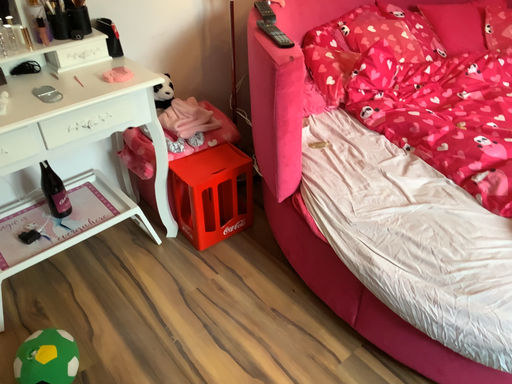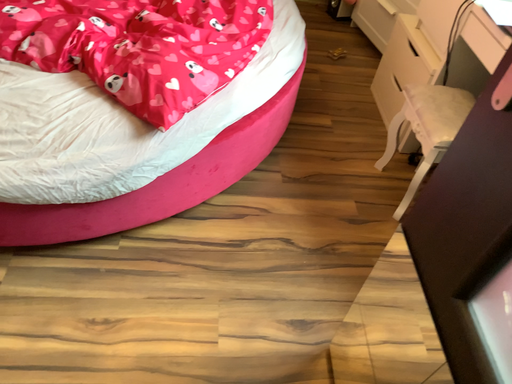
Question: Which way did the camera rotate in the video?

Choices:
 (A) rotated left
 (B) rotated right

Answer: (B)